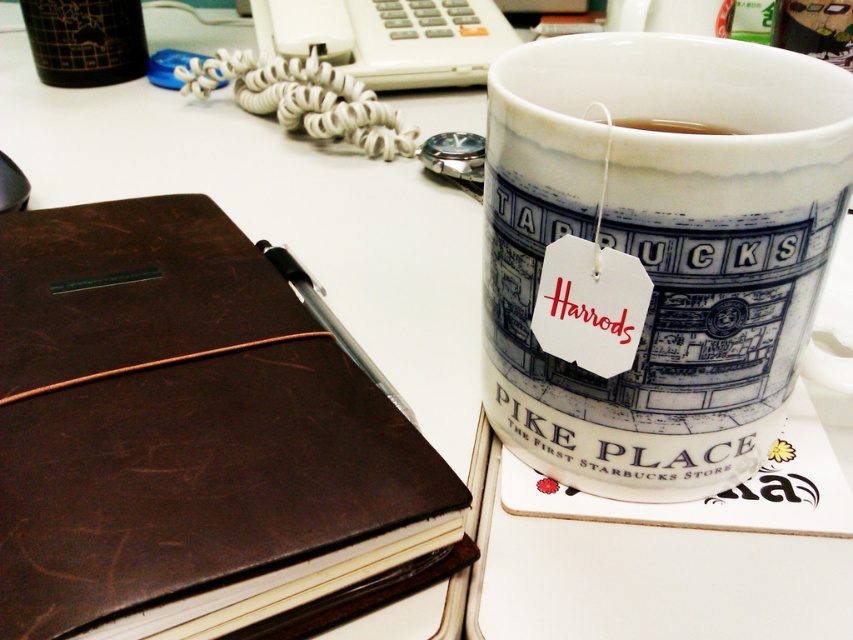
You have a small box that is 5 cm wide. You need to place it on the desk without overlapping any existing items. Which object between the brown leather notebook at left and the white paper tea bag at upper center can you place the box next to without exceeding its width?

The white paper tea bag at upper center has a smaller width than the brown leather notebook at left. Since the box is 5 cm wide, placing it next to the white paper tea bag at upper center would be more likely to fit as it has less width compared to the notebook.

You are organizing items on a desk. You need to place a new item between the brown leather notebook at left and the white paper tea bag at upper center. Where should you place it?

Place the new item between the brown leather notebook at left and the white paper tea bag at upper center, to the right of the brown leather notebook at left and to the left of the white paper tea bag at upper center.